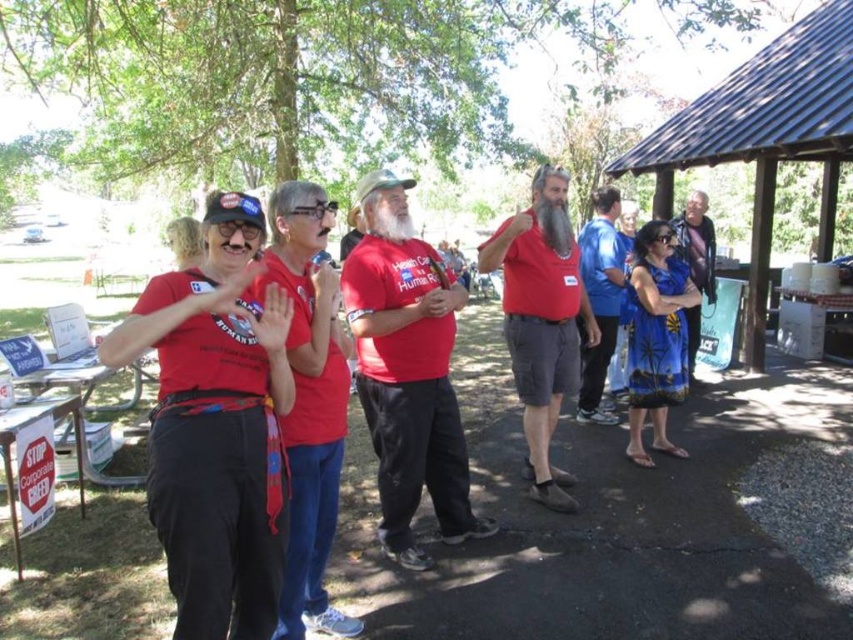
Question: Can you confirm if matte red tank top at center is wider than blue silk dress at right?

Choices:
 (A) no
 (B) yes

Answer: (A)

Question: Considering the relative positions of matte red t-shirt at center and blue silk dress at right in the image provided, where is matte red t-shirt at center located with respect to blue silk dress at right?

Choices:
 (A) below
 (B) above

Answer: (A)

Question: Is the position of blue shirt at right less distant than that of blue silk dress at right?

Choices:
 (A) yes
 (B) no

Answer: (A)

Question: Which of the following is the closest to the observer?

Choices:
 (A) blue shirt at right
 (B) blue silk dress at right

Answer: (A)

Question: Which object is the farthest from the blue shirt at right?

Choices:
 (A) matte red tank top at center
 (B) blue silk dress at right
 (C) matte red t-shirt at center

Answer: (C)

Question: Which object is positioned closest to the blue shirt at right?

Choices:
 (A) blue silk dress at right
 (B) matte red tank top at center

Answer: (B)